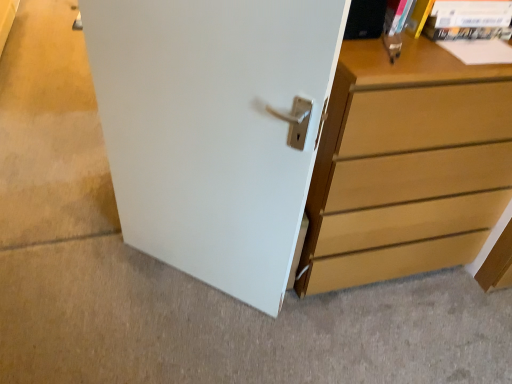
Question: Is white smooth door at center facing away from light brown wood chest of drawers at right?

Choices:
 (A) yes
 (B) no

Answer: (B)

Question: Considering the relative sizes of white smooth door at center and light brown wood chest of drawers at right in the image provided, is white smooth door at center wider than light brown wood chest of drawers at right?

Choices:
 (A) yes
 (B) no

Answer: (A)

Question: Considering the relative sizes of white smooth door at center and light brown wood chest of drawers at right in the image provided, is white smooth door at center taller than light brown wood chest of drawers at right?

Choices:
 (A) yes
 (B) no

Answer: (B)

Question: Is white smooth door at center in contact with light brown wood chest of drawers at right?

Choices:
 (A) yes
 (B) no

Answer: (B)

Question: Is white smooth door at center shorter than light brown wood chest of drawers at right?

Choices:
 (A) no
 (B) yes

Answer: (B)

Question: In the image, is light brown wood chest of drawers at right on the left side or the right side of white matte door at center?

Choices:
 (A) left
 (B) right

Answer: (B)

Question: Is point (376, 243) closer or farther from the camera than point (267, 248)?

Choices:
 (A) farther
 (B) closer

Answer: (A)

Question: From their relative heights in the image, would you say light brown wood chest of drawers at right is taller or shorter than white matte door at center?

Choices:
 (A) tall
 (B) short

Answer: (B)

Question: Relative to white matte door at center, is light brown wood chest of drawers at right in front or behind?

Choices:
 (A) front
 (B) behind

Answer: (B)

Question: Is light brown wood chest of drawers at right situated inside white smooth door at center or outside?

Choices:
 (A) outside
 (B) inside

Answer: (A)

Question: From a real-world perspective, is light brown wood chest of drawers at right above or below white smooth door at center?

Choices:
 (A) above
 (B) below

Answer: (A)

Question: From their relative heights in the image, would you say light brown wood chest of drawers at right is taller or shorter than white smooth door at center?

Choices:
 (A) tall
 (B) short

Answer: (A)

Question: Visually, is light brown wood chest of drawers at right positioned to the left or to the right of white smooth door at center?

Choices:
 (A) right
 (B) left

Answer: (A)

Question: Does point (292, 172) appear closer or farther from the camera than point (69, 344)?

Choices:
 (A) farther
 (B) closer

Answer: (B)

Question: Considering the positions of white matte door at center and white smooth door at center in the image, is white matte door at center taller or shorter than white smooth door at center?

Choices:
 (A) short
 (B) tall

Answer: (B)